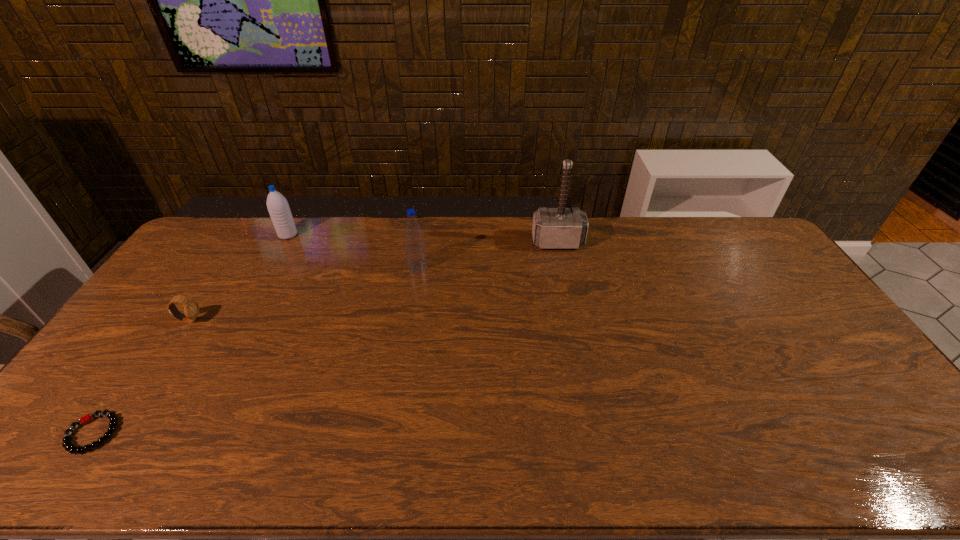
The image size is (960, 540). Identify the location of hammer. (553, 228).

Locate an element on the screen. the tallest object is located at coordinates (553, 228).

Locate an element on the screen. the second object from right to left is located at coordinates (415, 250).

Where is `the right water bottle`? The width and height of the screenshot is (960, 540). the right water bottle is located at coordinates (415, 250).

Where is `the third object from right to left`? the third object from right to left is located at coordinates (x=277, y=205).

Locate an element on the screen. The width and height of the screenshot is (960, 540). the farther water bottle is located at coordinates (277, 205).

Locate an element on the screen. This screenshot has width=960, height=540. the fourth tallest object is located at coordinates (191, 308).

Where is `watch`? watch is located at coordinates (191, 308).

What are the coordinates of `the nearest object` in the screenshot? It's located at (67, 443).

Locate an element on the screen. the shortest object is located at coordinates (67, 443).